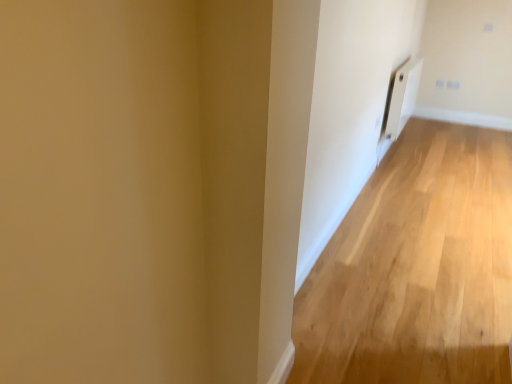
The height and width of the screenshot is (384, 512). I want to click on light wood floor at right, so click(x=416, y=268).

The height and width of the screenshot is (384, 512). Describe the element at coordinates (416, 268) in the screenshot. I see `light wood floor at right` at that location.

At what (x,y) coordinates should I click in order to perform the action: click on light wood floor at right. Please return your answer as a coordinate pair (x, y). Looking at the image, I should click on (416, 268).